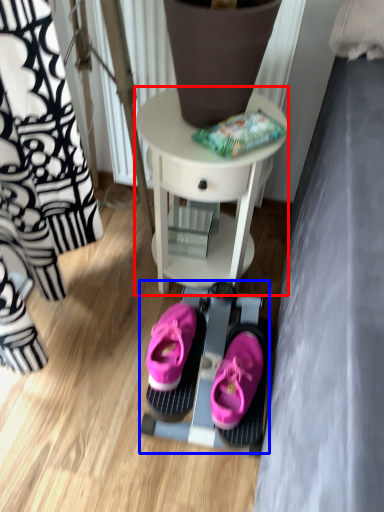
Question: Which object is further to the camera taking this photo, table (highlighted by a red box) or bunk bed (highlighted by a blue box)?

Choices:
 (A) table
 (B) bunk bed

Answer: (B)